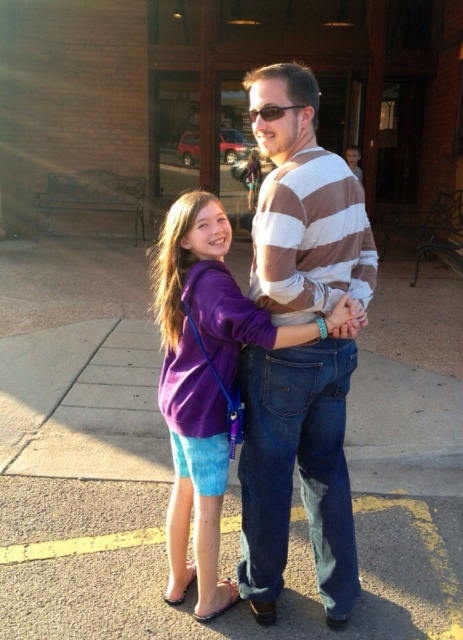
You are a photographer trying to capture a detailed shot of both the smooth concrete pavement at center and the striped cotton shirt at center in the image. Which object should you focus on first to ensure it appears larger in the photo?

The striped cotton shirt at center should be focused on first because it is larger than the smooth concrete pavement at center, ensuring it appears prominent in the photo.

You are a photographer setting up a shot of the scene described. You want to ensure that both the smooth concrete pavement at center and the matte purple shirt at center are clearly visible in your photo. Which object should you focus on first to ensure depth of field captures both effectively?

You should focus on the matte purple shirt at center first since it is behind the smooth concrete pavement at center. By focusing on the farther object, the depth of field will naturally include the closer object as well.

You are a delivery robot with a width of 1.2 meters. You need to navigate through the space between the smooth concrete pavement at center and the striped cotton shirt at center. Can you fit through this space without touching either side?

The distance between the smooth concrete pavement at center and the striped cotton shirt at center is 1.30 meters. Since your width is 1.2 meters, you can fit through the space as there is enough clearance.